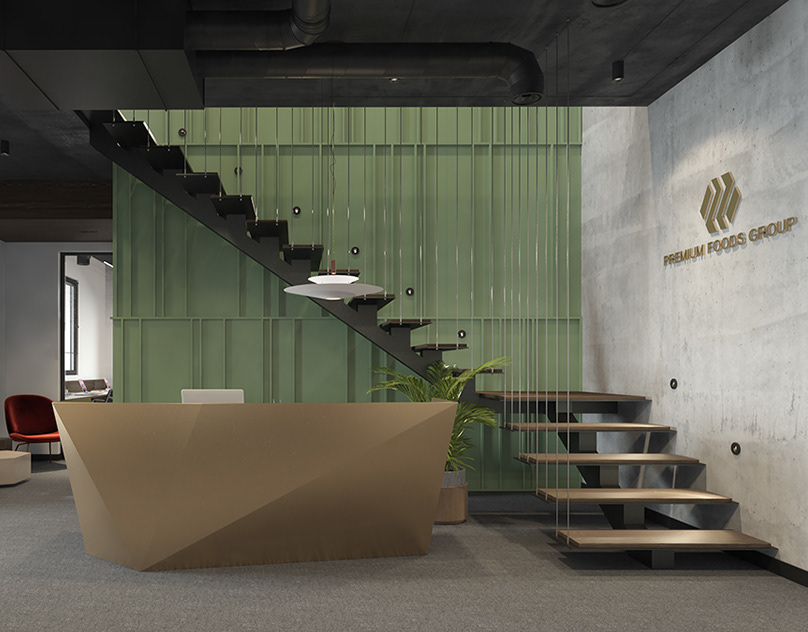
Where is `front desk`? The width and height of the screenshot is (808, 632). front desk is located at coordinates pos(246,478).